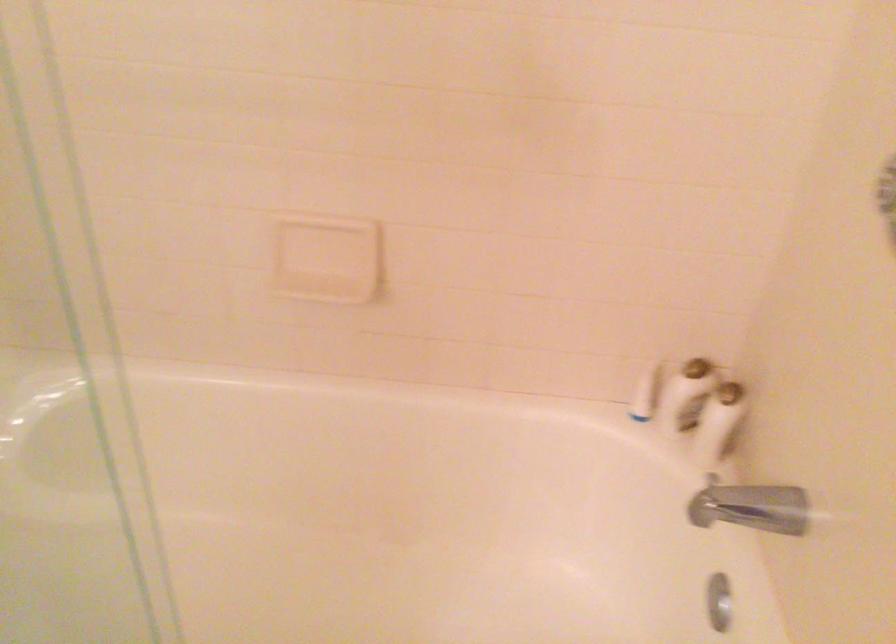
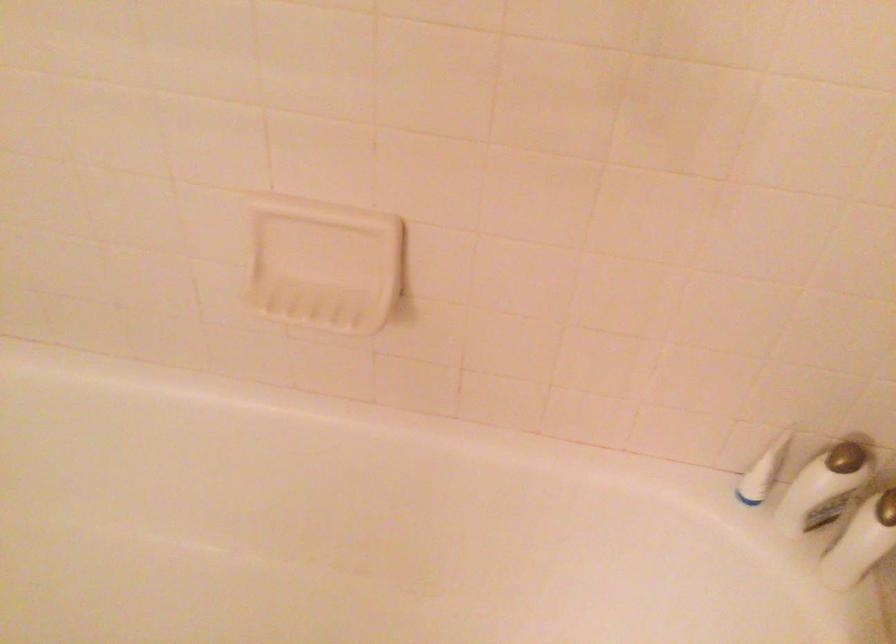
Question: The images are taken continuously from a first-person perspective. In which direction are you moving?

Choices:
 (A) Left
 (B) Right
 (C) Forward
 (D) Backward

Answer: (C)